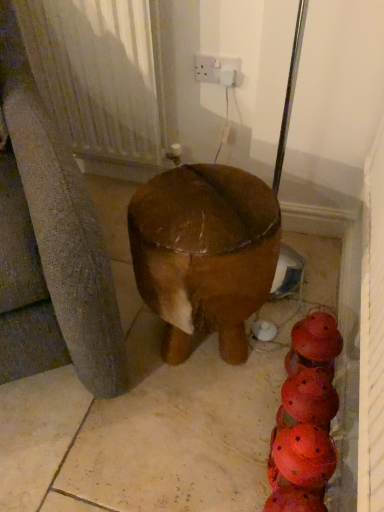
Question: In terms of width, does white plastic socket at upper center look wider or thinner when compared to brown polished wood stool at center?

Choices:
 (A) wide
 (B) thin

Answer: (B)

Question: Is point (215, 65) closer or farther from the camera than point (235, 267)?

Choices:
 (A) closer
 (B) farther

Answer: (B)

Question: Which object is the closest to the brown polished wood stool at center?

Choices:
 (A) white textured radiator at upper left
 (B) brown matte concrete at center
 (C) white plastic socket at upper center

Answer: (B)

Question: Which is nearer to the white plastic socket at upper center?

Choices:
 (A) brown matte concrete at center
 (B) brown polished wood stool at center
 (C) white textured radiator at upper left

Answer: (C)